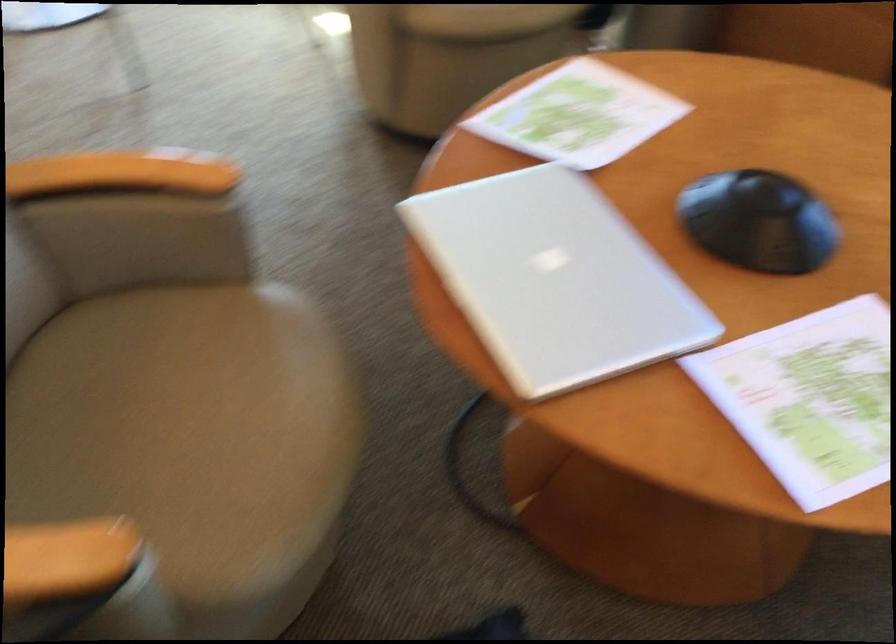
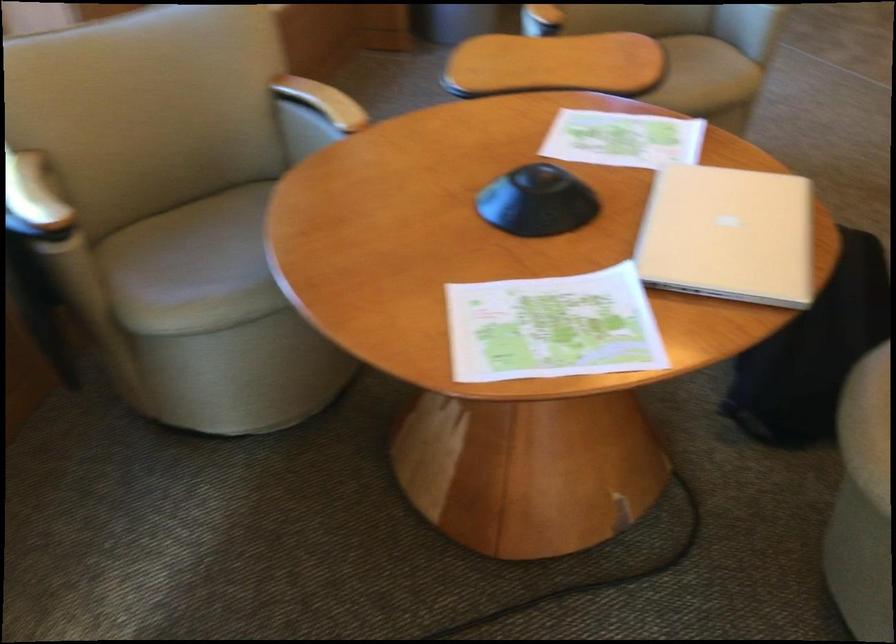
Find the pixel in the second image that matches point (701, 243) in the first image.

(537, 202)